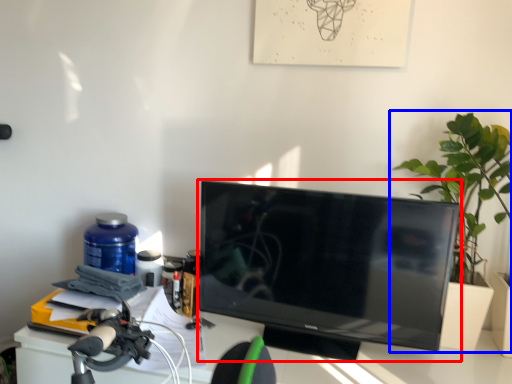
Question: Which of the following is the closest to the observer, television (highlighted by a red box) or houseplant (highlighted by a blue box)?

Choices:
 (A) television
 (B) houseplant

Answer: (A)